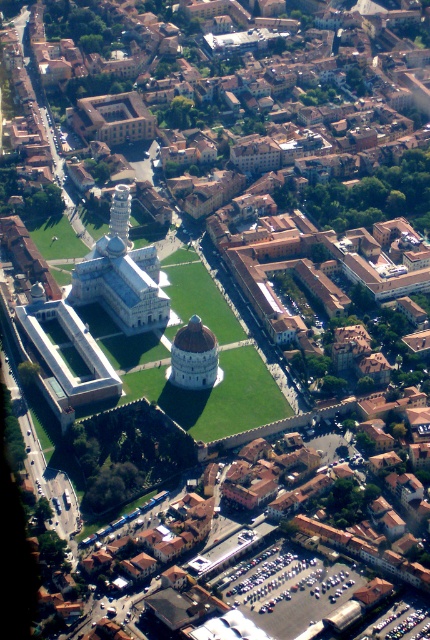
Find the location of a particular element. This screenshot has width=430, height=640. white stone tower at center is located at coordinates (122, 275).

What do you see at coordinates (122, 275) in the screenshot? The height and width of the screenshot is (640, 430). I see `white stone tower at center` at bounding box center [122, 275].

Locate an element on the screen. white stone tower at center is located at coordinates (122, 275).

Can you confirm if white marble dome at center is smaller than smooth white tower at center?

Yes.

Is white marble dome at center bigger than smooth white tower at center?

Actually, white marble dome at center might be smaller than smooth white tower at center.

Find the location of a particular element. white marble dome at center is located at coordinates (193, 356).

Between white stone tower at center and smooth white tower at center, which one appears on the right side from the viewer's perspective?

Positioned to the right is white stone tower at center.

Is point (80, 292) positioned before point (111, 216)?

No, it is behind (111, 216).

Between point (114, 257) and point (116, 212), which one is positioned behind?

Point (114, 257)

You are a GUI agent. You are given a task and a screenshot of the screen. Output one action in this format:
    pyautogui.click(x=<x>, y=<y>)
    Task: Click on the white stone tower at center
    
    Given the screenshot: What is the action you would take?
    pyautogui.click(x=122, y=275)